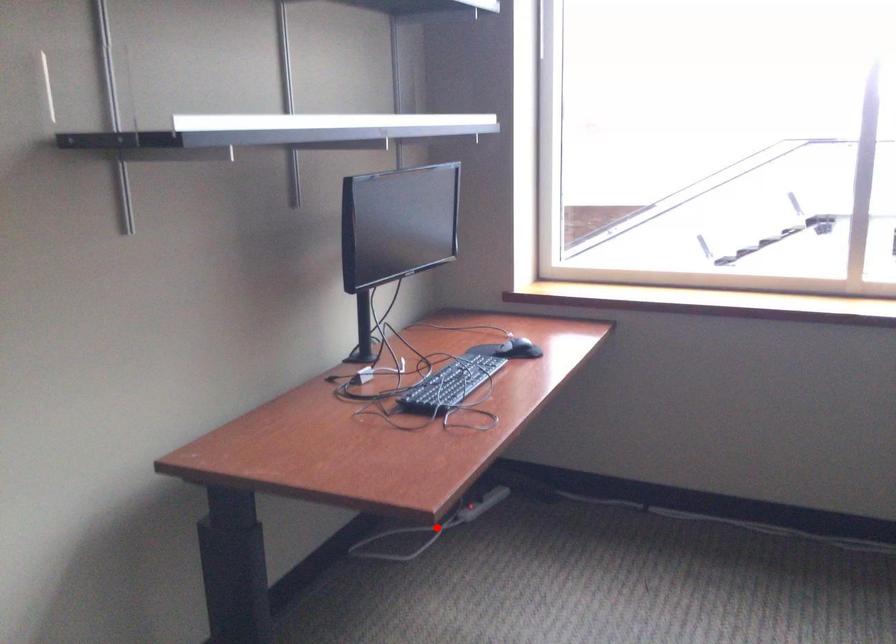
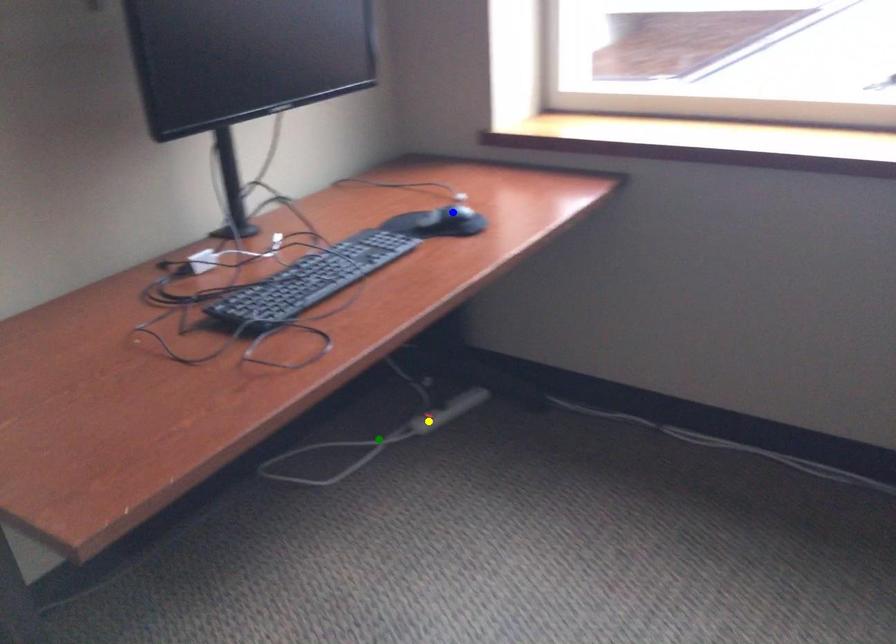
Question: I am providing you with two images of the same scene from different viewpoints. A red point is marked on the first image. You are given multiple points on the second image. In image 2, which mark is for the same physical point as the one in image 1?

Choices:
 (A) blue point
 (B) green point
 (C) yellow point

Answer: (B)